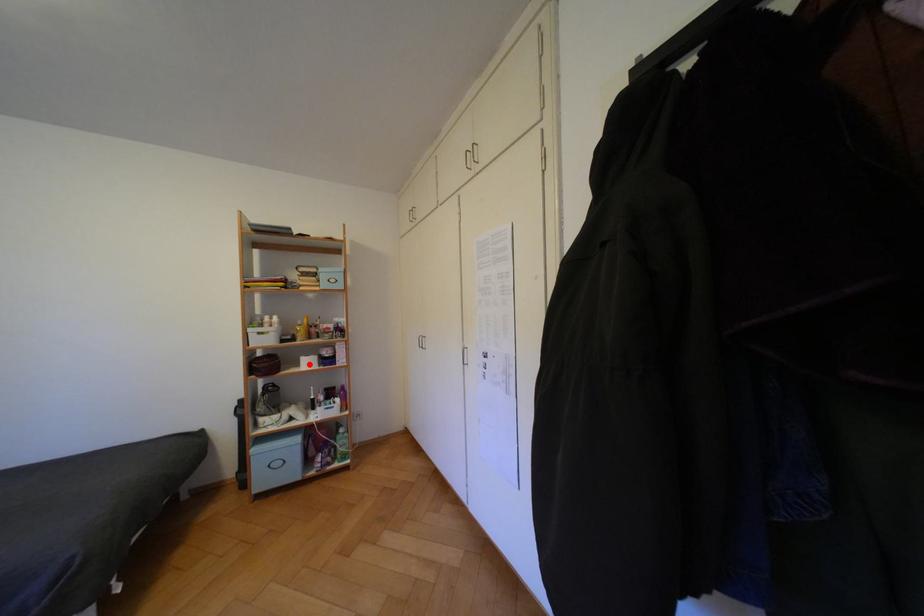
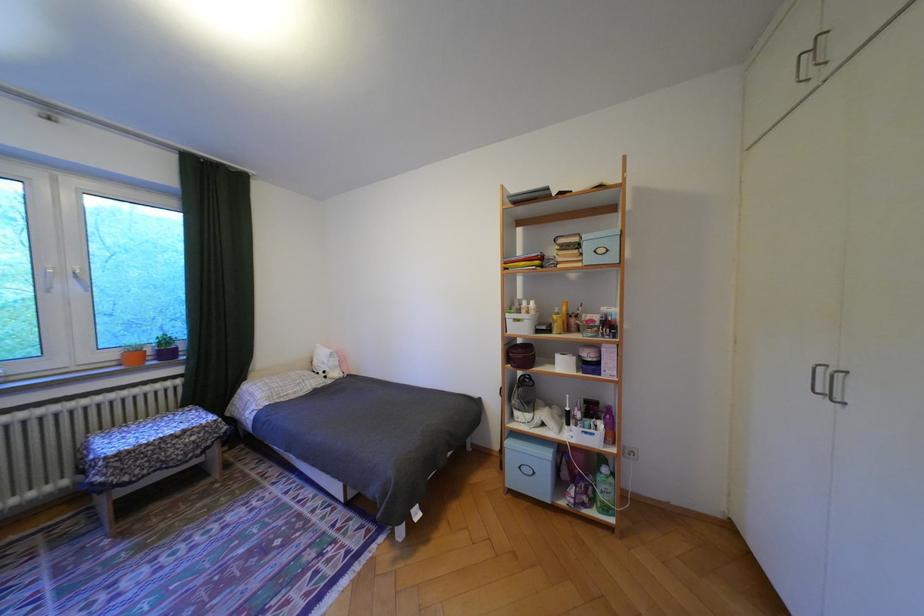
In the second image, find the point that corresponds to the highlighted location in the first image.

(564, 362)